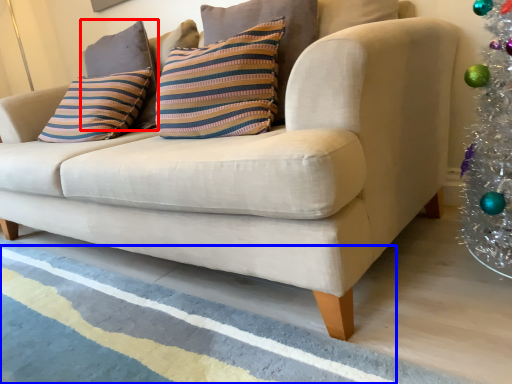
Question: Among these objects, which one is nearest to the camera, pillow (highlighted by a red box) or stripe (highlighted by a blue box)?

Choices:
 (A) pillow
 (B) stripe

Answer: (B)